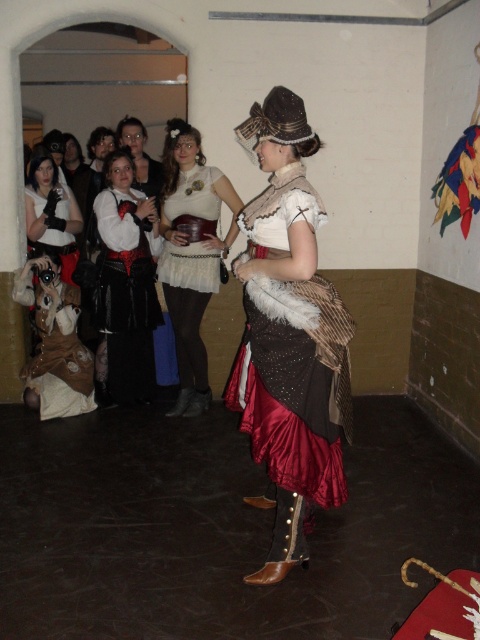
Can you confirm if satin brown dress at center is positioned to the right of brown leather vest at lower left?

Yes, satin brown dress at center is to the right of brown leather vest at lower left.

Can you confirm if satin brown dress at center is taller than brown leather vest at lower left?

Yes, satin brown dress at center is taller than brown leather vest at lower left.

The height and width of the screenshot is (640, 480). I want to click on satin brown dress at center, so click(289, 336).

This screenshot has width=480, height=640. Describe the element at coordinates (289, 336) in the screenshot. I see `satin brown dress at center` at that location.

Is point (274, 176) positioned after point (111, 392)?

No.

The height and width of the screenshot is (640, 480). Describe the element at coordinates (289, 336) in the screenshot. I see `satin brown dress at center` at that location.

The height and width of the screenshot is (640, 480). I want to click on satin brown dress at center, so click(x=289, y=336).

Looking at this image, which is more to the right, satin brown dress at center or matte white dress at center?

From the viewer's perspective, satin brown dress at center appears more on the right side.

Who is more forward, (295, 557) or (172, 259)?

Positioned in front is point (295, 557).

Where is `satin brown dress at center`? satin brown dress at center is located at coordinates (289, 336).